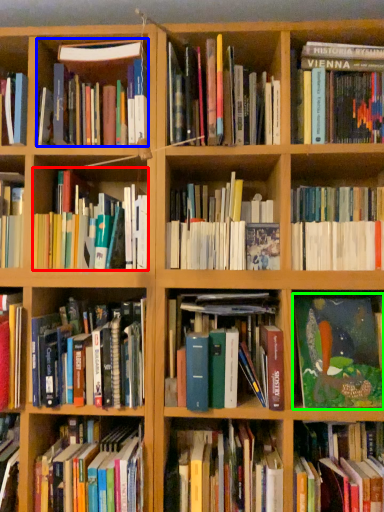
Question: Estimate the real-world distances between objects in this image. Which object is closer to book (highlighted by a red box), book (highlighted by a blue box) or book (highlighted by a green box)?

Choices:
 (A) book
 (B) book

Answer: (A)